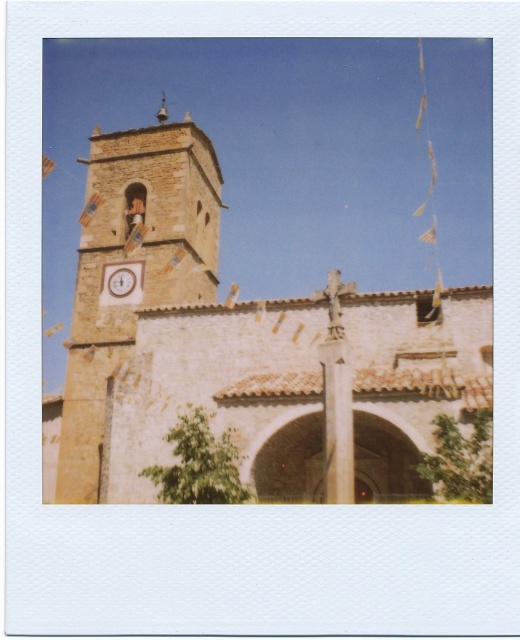
Can you confirm if white stone statue at center is taller than matte brown clock at center-left?

Correct, white stone statue at center is much taller as matte brown clock at center-left.

Which is more to the right, white stone statue at center or matte brown clock at center-left?

From the viewer's perspective, white stone statue at center appears more on the right side.

Measure the distance between point (338, 470) and camera.

Point (338, 470) and camera are 29.84 meters apart from each other.

This screenshot has height=640, width=520. What are the coordinates of `white stone statue at center` in the screenshot? It's located at tap(336, 396).

Which of these two, beige stone church at center or matte brown clock at center-left, stands shorter?

matte brown clock at center-left

Is beige stone church at center positioned at the back of matte brown clock at center-left?

No, beige stone church at center is closer to the viewer.

What do you see at coordinates (241, 346) in the screenshot? I see `beige stone church at center` at bounding box center [241, 346].

Where is `beige stone church at center`? beige stone church at center is located at coordinates pyautogui.click(x=241, y=346).

Which is more to the right, beige stone church at center or white stone statue at center?

Positioned to the right is white stone statue at center.

Is beige stone church at center taller than white stone statue at center?

Indeed, beige stone church at center has a greater height compared to white stone statue at center.

Find the location of a particular element. beige stone church at center is located at coordinates (241, 346).

Where is `beige stone church at center`? Image resolution: width=520 pixels, height=640 pixels. beige stone church at center is located at coordinates (241, 346).